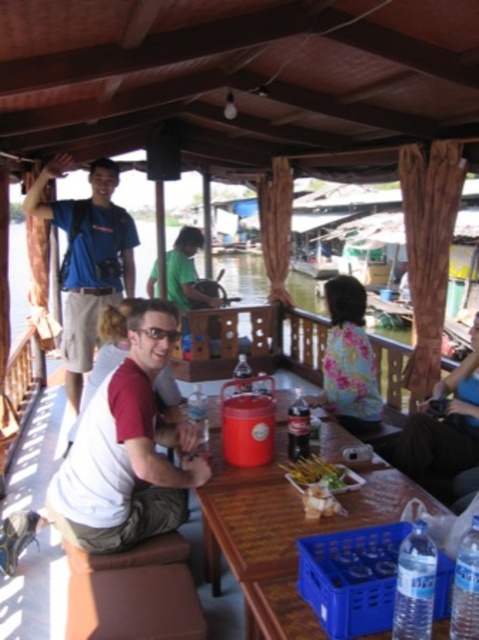
Question: Based on their relative distances, which object is nearer to the dark brown leather jacket at right?

Choices:
 (A) blue fabric shirt at upper left
 (B) golden crispy skewers at center
 (C) wooden table at center
 (D) white matte shirt at center

Answer: (C)

Question: Among these objects, which one is farthest from the camera?

Choices:
 (A) floral fabric shirt at center
 (B) wooden table at center

Answer: (A)

Question: Does wooden table at center appear over blue fabric shirt at upper left?

Choices:
 (A) no
 (B) yes

Answer: (A)

Question: Is white matte shirt at center above dark brown leather jacket at right?

Choices:
 (A) no
 (B) yes

Answer: (B)

Question: Is white matte shirt at center to the left of dark brown leather jacket at right from the viewer's perspective?

Choices:
 (A) yes
 (B) no

Answer: (A)

Question: Which object appears farthest from the camera in this image?

Choices:
 (A) white matte shirt at center
 (B) golden crispy skewers at center
 (C) floral fabric shirt at center

Answer: (C)